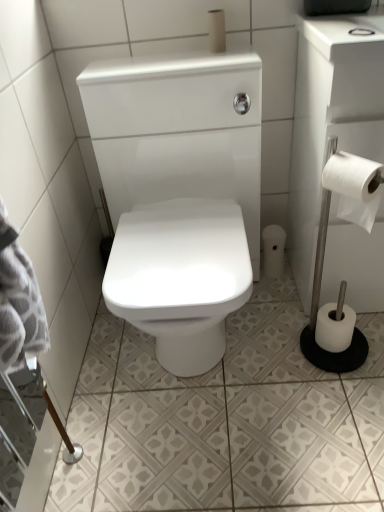
The width and height of the screenshot is (384, 512). In order to click on free space in front of white paper roll at lower right, marked as the 2th toilet paper in a left-to-right arrangement in this screenshot , I will do `click(275, 298)`.